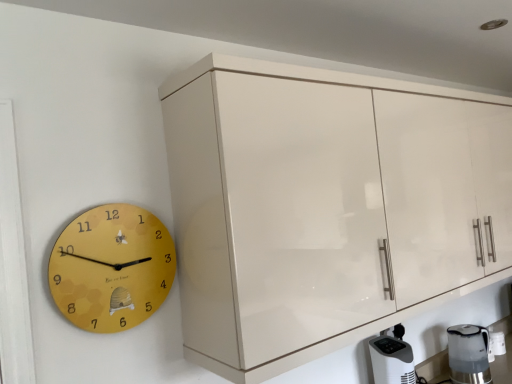
Question: Does point (78, 258) appear closer or farther from the camera than point (443, 367)?

Choices:
 (A) farther
 (B) closer

Answer: (B)

Question: Looking at the image, does yellow matte clock at left seem bigger or smaller compared to satin silver kettle at lower right?

Choices:
 (A) big
 (B) small

Answer: (B)

Question: Which is nearer to the satin silver kettle at lower right?

Choices:
 (A) glossy cream cabinet at upper right
 (B) yellow matte clock at left
 (C) white plastic air purifier at lower right

Answer: (C)

Question: Estimate the real-world distances between objects in this image. Which object is closer to the white plastic air purifier at lower right?

Choices:
 (A) yellow matte clock at left
 (B) satin silver kettle at lower right
 (C) glossy cream cabinet at upper right

Answer: (B)